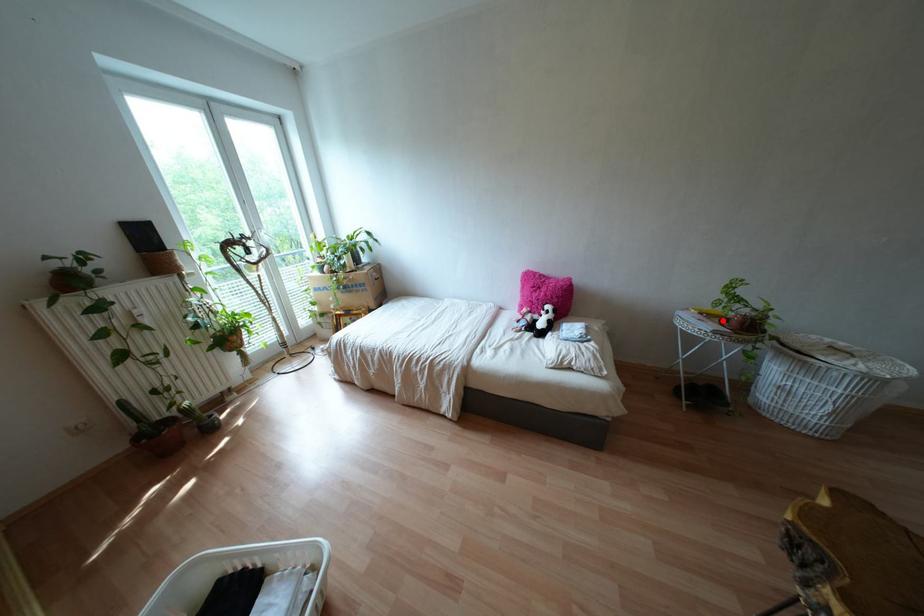
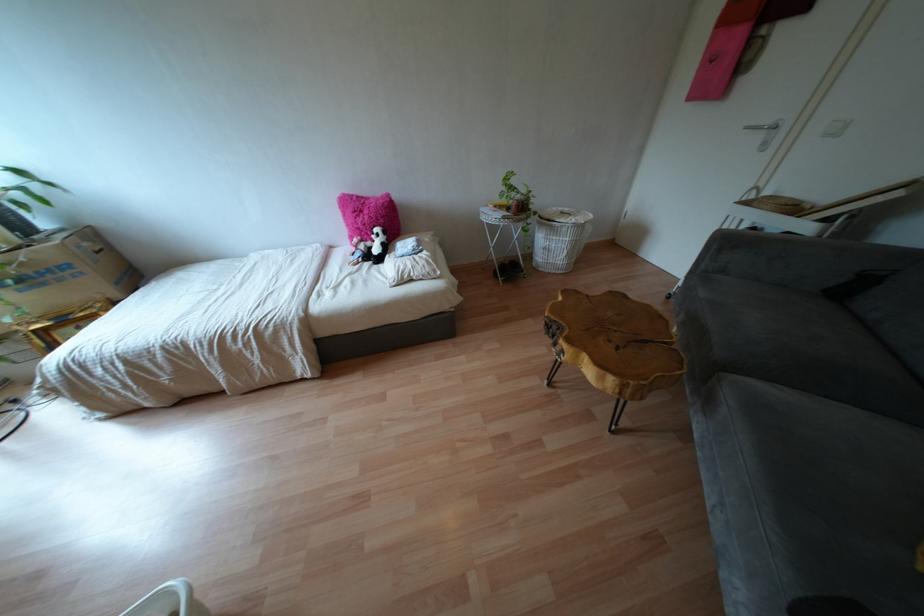
In the second image, find the point that corresponds to the highlighted location in the first image.

(506, 208)